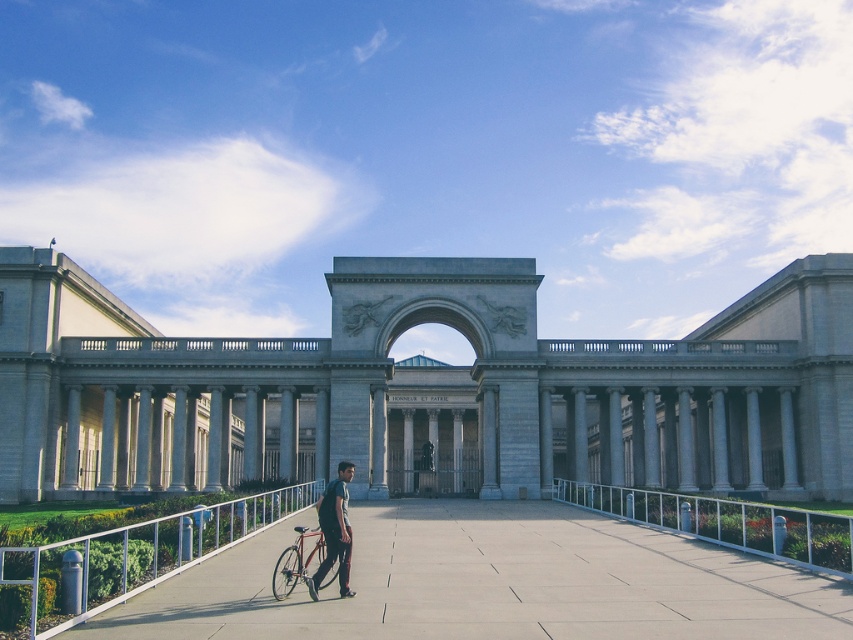
Can you confirm if gray stone palace at center is positioned to the left of dark gray fabric backpack at center?

No, gray stone palace at center is not to the left of dark gray fabric backpack at center.

Who is shorter, gray stone palace at center or dark gray fabric backpack at center?

Standing shorter between the two is dark gray fabric backpack at center.

Which is in front, point (582, 444) or point (329, 483)?

Positioned in front is point (329, 483).

This screenshot has height=640, width=853. I want to click on gray stone palace at center, so click(427, 410).

Looking at this image, which is above, concrete pavement at center or white metal railing at lower left?

Positioned higher is white metal railing at lower left.

Is point (639, 564) positioned in front of point (19, 552)?

No, it is behind (19, 552).

Identify the location of concrete pavement at center. This screenshot has height=640, width=853. [x=491, y=582].

Can you confirm if gray stone palace at center is positioned to the left of shiny metallic bicycle at center?

In fact, gray stone palace at center is to the right of shiny metallic bicycle at center.

Is gray stone palace at center to the right of shiny metallic bicycle at center from the viewer's perspective?

Yes, gray stone palace at center is to the right of shiny metallic bicycle at center.

Is point (463, 307) positioned in front of point (283, 548)?

No, (463, 307) is further to viewer.

Locate an element on the screen. gray stone palace at center is located at coordinates (427, 410).